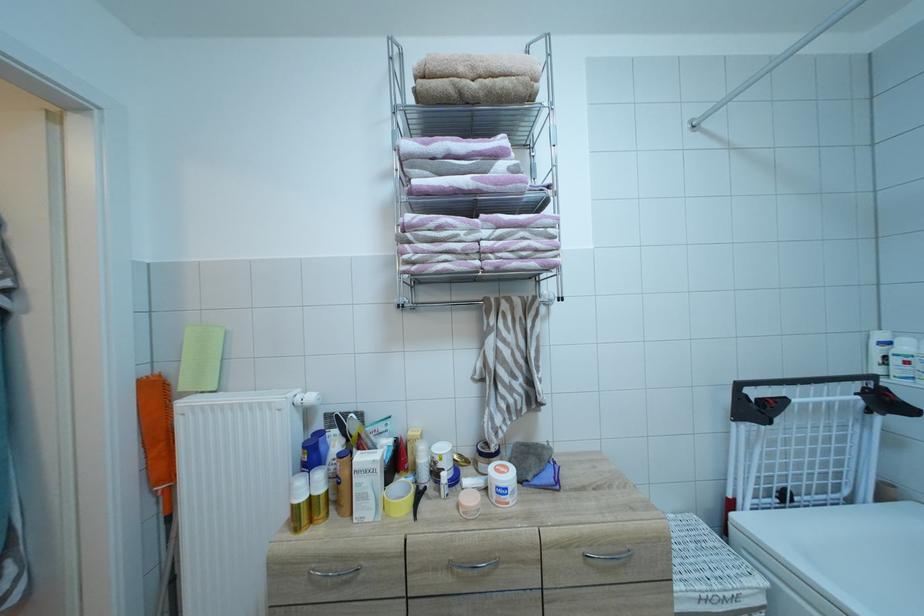
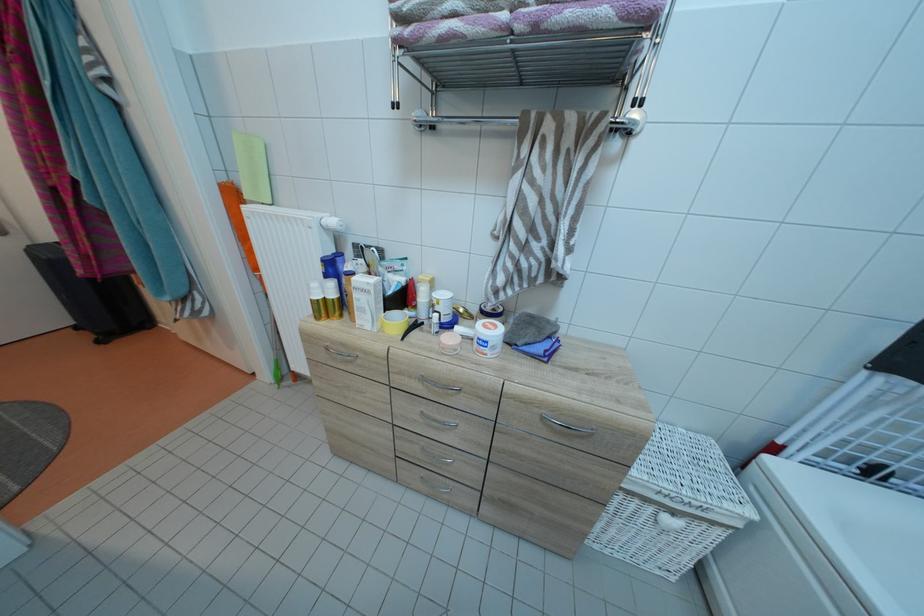
The point at (326, 479) is marked in the first image. Where is the corresponding point in the second image?

(338, 290)